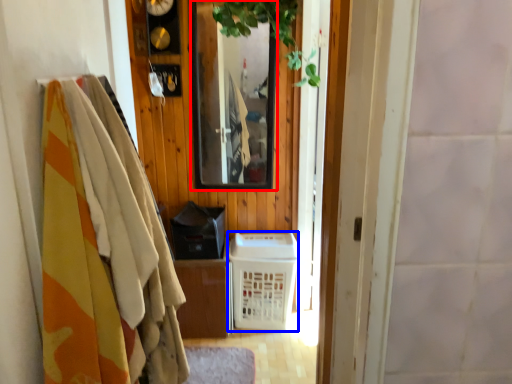
Question: Which object is further to the camera taking this photo, mirror (highlighted by a red box) or basket (highlighted by a blue box)?

Choices:
 (A) mirror
 (B) basket

Answer: (B)